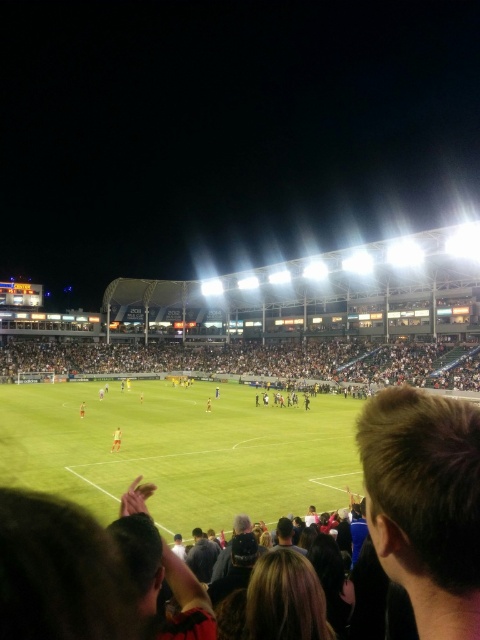
Question: Does light brown leather jacket at center have a smaller size compared to orange fabric person at center?

Choices:
 (A) yes
 (B) no

Answer: (A)

Question: Which object is closer to the camera taking this photo?

Choices:
 (A) orange fabric person at center
 (B) dark gray crowd at center

Answer: (A)

Question: Which object is farther from the camera taking this photo?

Choices:
 (A) light brown leather jacket at center
 (B) yellow jersey at center
 (C) dark gray crowd at center
 (D) orange fabric person at center

Answer: (C)

Question: Considering the relative positions of dark gray crowd at center and orange fabric person at center in the image provided, where is dark gray crowd at center located with respect to orange fabric person at center?

Choices:
 (A) below
 (B) above

Answer: (B)

Question: Which point is closer to the camera?

Choices:
 (A) light brown leather jacket at center
 (B) orange fabric person at center

Answer: (A)

Question: Is light brown leather jacket at center above orange fabric person at center?

Choices:
 (A) no
 (B) yes

Answer: (B)